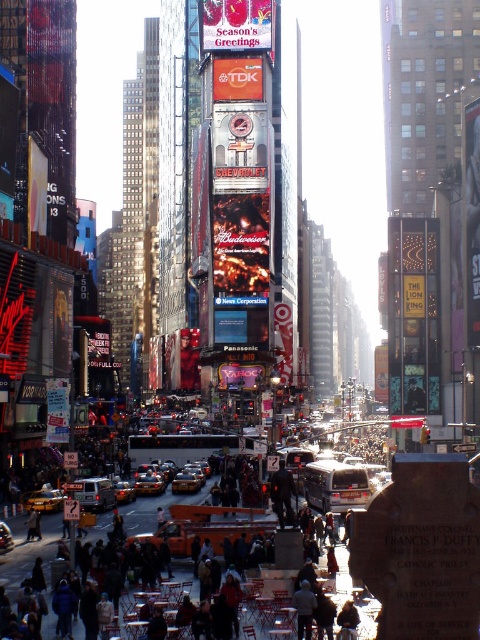
Question: Can you confirm if dark gray concrete crowd at center is thinner than yellowmetallictaxi at center?

Choices:
 (A) yes
 (B) no

Answer: (B)

Question: Estimate the real-world distances between objects in this image. Which object is farther from the yellowmattetaxi at center?

Choices:
 (A) dark gray concrete crowd at center
 (B) yellowmetallictaxi at center
 (C) yellowmattetaxi at lower left

Answer: (A)

Question: Can you confirm if dark gray pants at center is positioned to the right of yellowmetallictaxi at center?

Choices:
 (A) no
 (B) yes

Answer: (B)

Question: Is yellowmattetaxi at lower left to the left of yellowmetallictaxi at center from the viewer's perspective?

Choices:
 (A) no
 (B) yes

Answer: (B)

Question: Estimate the real-world distances between objects in this image. Which object is closer to the yellowmattetaxi at center?

Choices:
 (A) yellowmetallictaxi at center
 (B) yellow metallic taxi at center

Answer: (A)

Question: Estimate the real-world distances between objects in this image. Which object is closer to the yellowmattetaxi at center?

Choices:
 (A) yellow metallic taxi at center
 (B) yellowmetallictaxi at center
 (C) dark gray pants at center
 (D) yellowmattetaxi at lower left

Answer: (B)